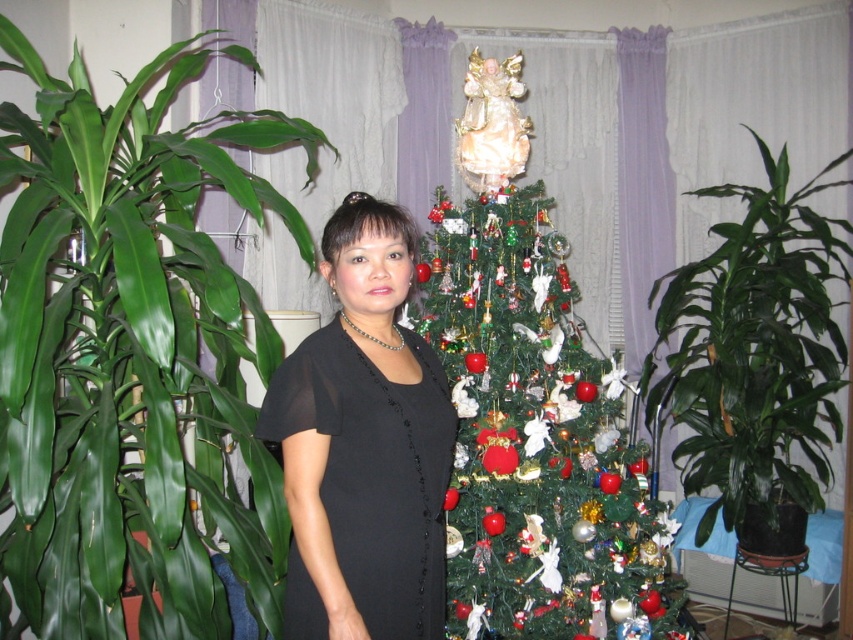
Is green leafy plant at center to the left of black sheer dress at center from the viewer's perspective?

In fact, green leafy plant at center is to the right of black sheer dress at center.

Between green leafy plant at center and black sheer dress at center, which one is positioned lower?

black sheer dress at center is lower down.

Is point (699, 444) less distant than point (363, 444)?

No.

At what (x,y) coordinates should I click in order to perform the action: click on green leafy plant at center. Please return your answer as a coordinate pair (x, y). Image resolution: width=853 pixels, height=640 pixels. Looking at the image, I should click on (755, 349).

Is green matte christmas tree at center positioned behind black sheer dress at center?

Yes, it is.

Which is above, green matte christmas tree at center or black sheer dress at center?

green matte christmas tree at center is higher up.

This screenshot has height=640, width=853. What do you see at coordinates (532, 410) in the screenshot?
I see `green matte christmas tree at center` at bounding box center [532, 410].

You are a GUI agent. You are given a task and a screenshot of the screen. Output one action in this format:
    pyautogui.click(x=<x>, y=<y>)
    Task: Click on the green matte christmas tree at center
    The image size is (853, 640).
    Given the screenshot: What is the action you would take?
    pyautogui.click(x=532, y=410)

Can you confirm if green glossy leafy plant at left is positioned above black sheer dress at center?

Yes.

Does point (97, 365) come in front of point (438, 406)?

No.

This screenshot has height=640, width=853. I want to click on green glossy leafy plant at left, so click(x=131, y=355).